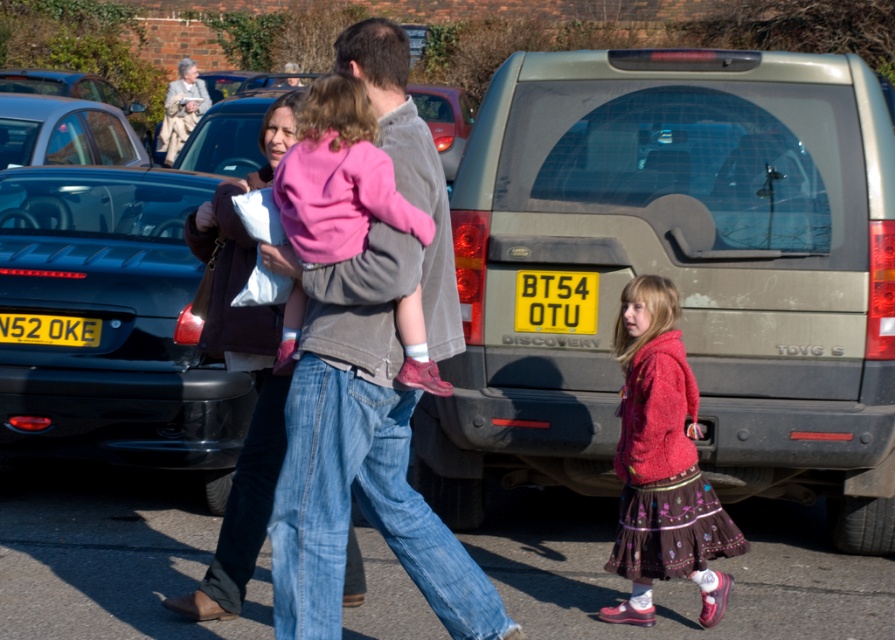
Question: Which of the following is the closest to the observer?

Choices:
 (A) shiny black car at left
 (B) light beige coat at upper left
 (C) pink fleece jacket at center
 (D) matte brown jacket at center

Answer: (C)

Question: Among these objects, which one is nearest to the camera?

Choices:
 (A) light beige coat at upper left
 (B) matte brown jacket at center
 (C) yellow plastic license plate at center

Answer: (B)

Question: Does denim jeans at center appear on the right side of light beige coat at upper left?

Choices:
 (A) yes
 (B) no

Answer: (A)

Question: Does denim jeans at center have a greater width compared to pink fleece jacket at center?

Choices:
 (A) yes
 (B) no

Answer: (A)

Question: Which point is closer to the camera?

Choices:
 (A) (243, 321)
 (B) (652, 358)
 (C) (325, 250)
 (D) (6, 400)

Answer: (C)

Question: Can you confirm if shiny black car at left is positioned to the right of light beige coat at upper left?

Choices:
 (A) no
 (B) yes

Answer: (B)